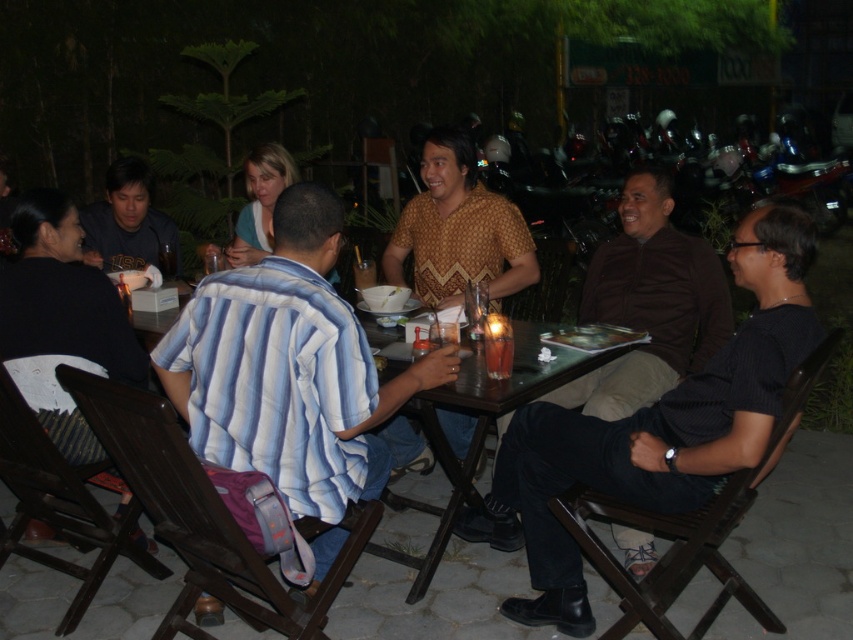
Question: Does matte black shirt at left have a greater width compared to translucent plastic cup at table center?

Choices:
 (A) no
 (B) yes

Answer: (B)

Question: Which is nearer to the blue striped shirt at center?

Choices:
 (A) dark brown shirt at center
 (B) translucent plastic cup at table center
 (C) matte black shirt at left

Answer: (B)

Question: In this image, where is blue striped shirt at center located relative to translucent plastic cup at table center?

Choices:
 (A) left
 (B) right

Answer: (A)

Question: Which of the following is the closest to the observer?

Choices:
 (A) translucent glass cup at center
 (B) translucent plastic cup at table center
 (C) dark brown shirt at center
 (D) matte black shirt at left

Answer: (B)

Question: Which point is closer to the camera?

Choices:
 (A) (675, 253)
 (B) (508, 355)

Answer: (B)

Question: Can you confirm if blue striped shirt at center is positioned to the right of dark brown shirt at center?

Choices:
 (A) no
 (B) yes

Answer: (A)